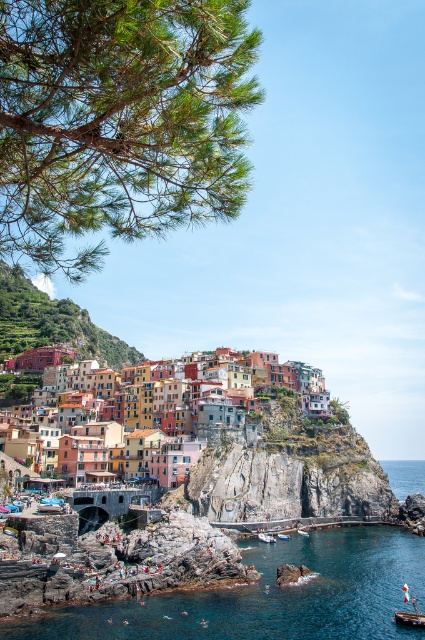
You are a tourist standing on the rocky cliff overlooking the clear blue water at lower center and the white plastic boat at lower center. Which object is positioned higher from the ground level?

The clear blue water at lower center is above the white plastic boat at lower center, so the clear blue water at lower center is higher from the ground level.

Looking at this image, you are a tourist standing on the cliff overlooking the multicolored stone village at center and the white plastic boat at lower center. Which object appears wider from your viewpoint?

The multicolored stone village at center appears wider than the white plastic boat at lower center because its width is larger according to the description.